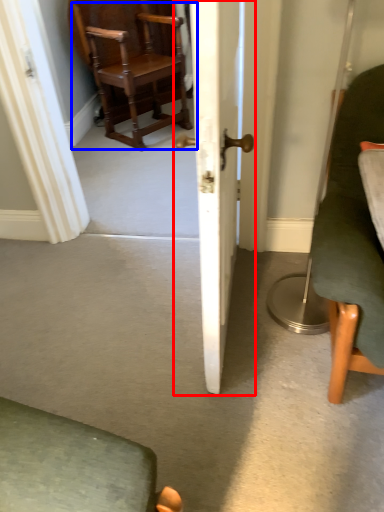
Question: Which of the following is the closest to the observer, door (highlighted by a red box) or chair (highlighted by a blue box)?

Choices:
 (A) door
 (B) chair

Answer: (A)